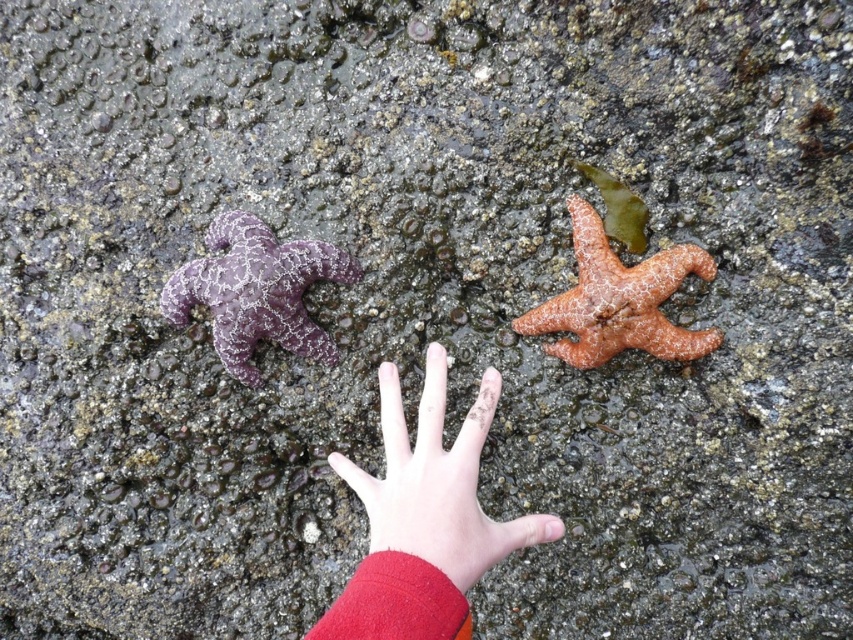
Based on the photo, you are a marine biologist examining the starfish in the tide pool. You need to determine which object is wider between the smooth skin hand at center and the orange matte starfish at center right. Which one is wider?

The smooth skin hand at center is wider than the orange matte starfish at center right according to the description provided.

You are a marine biologist examining the starfish in the tide pool. You need to collect the purple matte starfish at left and the orange matte starfish at center right. Which one should you pick up first if you want to reach the closer one first?

The purple matte starfish at left is closer to you than the orange matte starfish at center right, so you should pick up the purple matte starfish at left first.